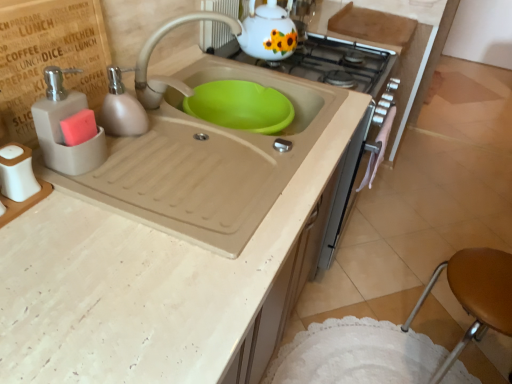
Question: Can you confirm if beige matte sink at center is smaller than white glossy gas stove at upper center?

Choices:
 (A) yes
 (B) no

Answer: (B)

Question: Is beige matte sink at center oriented towards white glossy gas stove at upper center?

Choices:
 (A) yes
 (B) no

Answer: (B)

Question: Is beige matte sink at center not inside white glossy gas stove at upper center?

Choices:
 (A) yes
 (B) no

Answer: (A)

Question: Is beige matte sink at center to the right of white glossy gas stove at upper center from the viewer's perspective?

Choices:
 (A) no
 (B) yes

Answer: (A)

Question: From the image's perspective, is beige matte sink at center beneath white glossy gas stove at upper center?

Choices:
 (A) yes
 (B) no

Answer: (A)

Question: Is beige matte sink at center closer to camera compared to white glossy gas stove at upper center?

Choices:
 (A) no
 (B) yes

Answer: (B)

Question: Considering the relative positions of matte gray soap dispenser at left, the 2th soap dispenser positioned from the back, and white glossy gas stove at upper center in the image provided, is matte gray soap dispenser at left, the 2th soap dispenser positioned from the back, to the left of white glossy gas stove at upper center from the viewer's perspective?

Choices:
 (A) no
 (B) yes

Answer: (B)

Question: Is matte gray soap dispenser at left, the 2th soap dispenser positioned from the back, facing away from white glossy gas stove at upper center?

Choices:
 (A) no
 (B) yes

Answer: (A)

Question: Does matte gray soap dispenser at left, the 2th soap dispenser positioned from the back, appear on the right side of white glossy gas stove at upper center?

Choices:
 (A) no
 (B) yes

Answer: (A)

Question: Does matte gray soap dispenser at left, which appears as the 1th soap dispenser when viewed from the front, come behind white glossy gas stove at upper center?

Choices:
 (A) no
 (B) yes

Answer: (A)

Question: Is matte gray soap dispenser at left, which appears as the 1th soap dispenser when viewed from the front, outside of white glossy gas stove at upper center?

Choices:
 (A) no
 (B) yes

Answer: (B)

Question: Does matte gray soap dispenser at left, which appears as the 1th soap dispenser when viewed from the front, have a lesser width compared to white glossy gas stove at upper center?

Choices:
 (A) no
 (B) yes

Answer: (B)

Question: Would you say matte gray soap dispenser at left is outside beige matte sink at center?

Choices:
 (A) no
 (B) yes

Answer: (B)